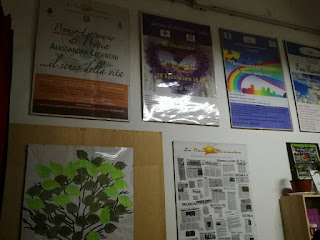
Locate an element on the screen. purple in shelf is located at coordinates (313, 212).